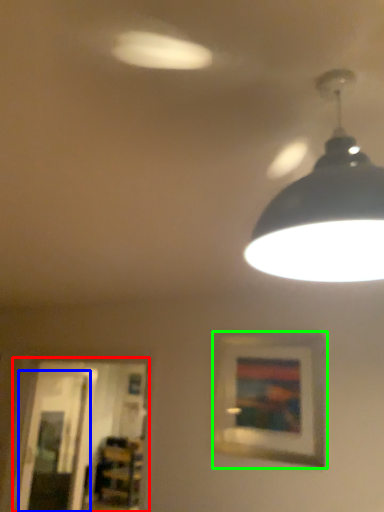
Question: Which is nearer to the glass door (highlighted by a red box)? glass door (highlighted by a blue box) or picture frame (highlighted by a green box).

Choices:
 (A) glass door
 (B) picture frame

Answer: (A)